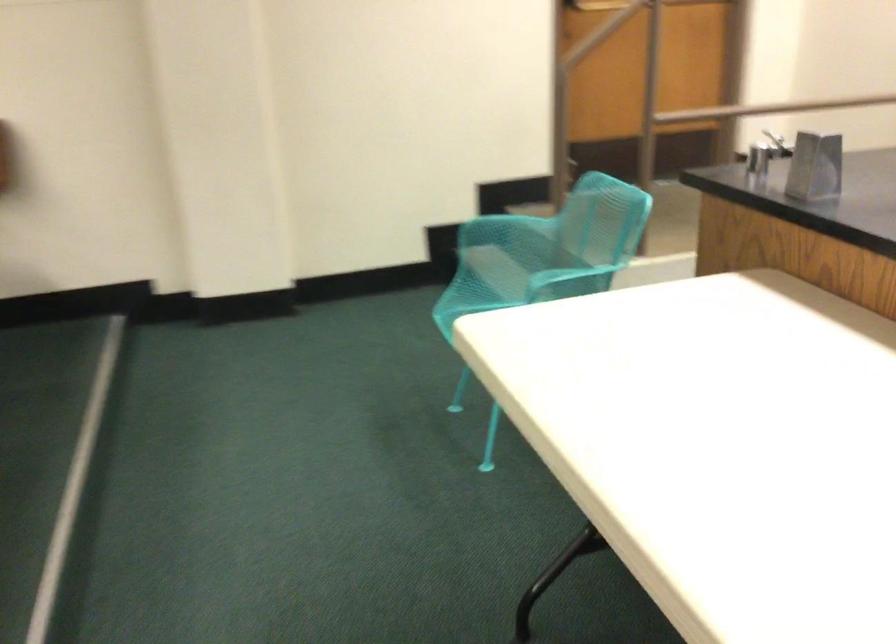
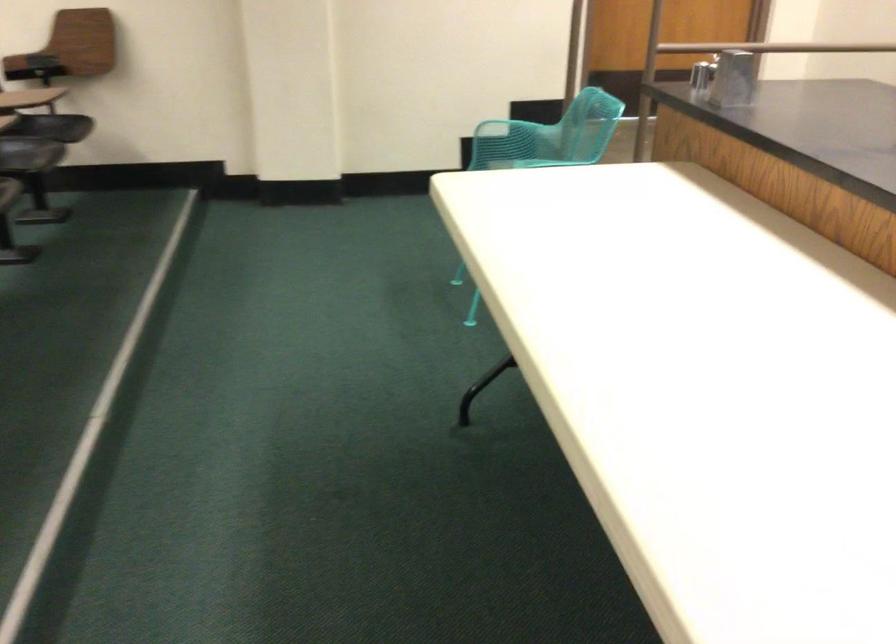
Question: I am providing you with two images of the same scene from different viewpoints. Which of the following objects are not visible in image2?

Choices:
 (A) chair sitting surface
 (B) turquoise sitting surface
 (C) metal shaker
 (D) orange pen holder

Answer: (B)